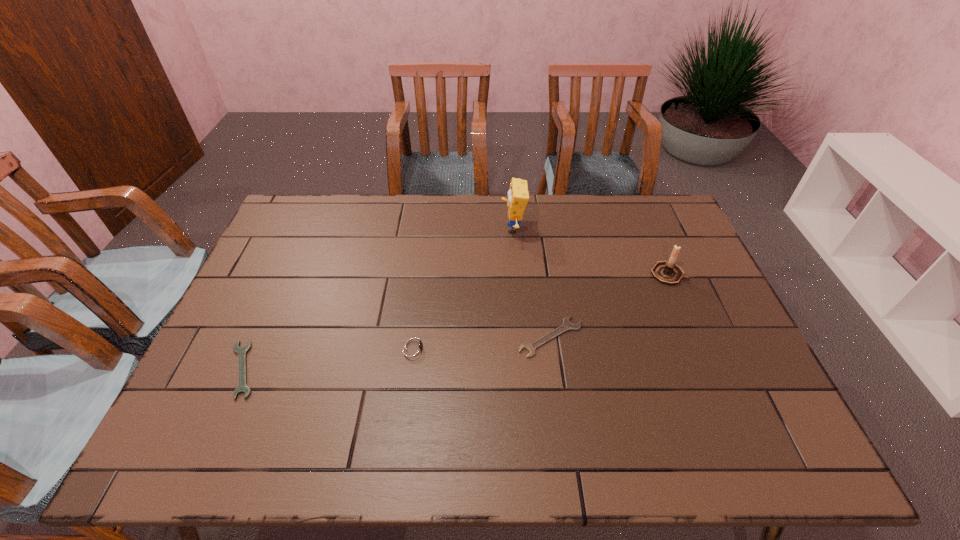
I want to click on the tallest object, so click(x=518, y=195).

At what (x,y) coordinates should I click in order to perform the action: click on sponge. Please return your answer as a coordinate pair (x, y). The image size is (960, 540). Looking at the image, I should click on (518, 195).

Find the location of a particular element. This screenshot has height=540, width=960. the rightmost object is located at coordinates (667, 272).

Identify the location of the second tallest object. This screenshot has height=540, width=960. (667, 272).

The image size is (960, 540). Identify the location of watch. (413, 348).

Where is `the second object from left to right`? This screenshot has height=540, width=960. the second object from left to right is located at coordinates (413, 348).

Where is `the right wrench`? the right wrench is located at coordinates (567, 325).

This screenshot has width=960, height=540. What are the coordinates of `the left wrench` in the screenshot? It's located at (242, 387).

Find the location of a particular element. Image resolution: width=960 pixels, height=540 pixels. free point located 0.200m on the face of the farthest object is located at coordinates (442, 228).

At what (x,y) coordinates should I click in order to perform the action: click on vacant space located on the face of the farthest object. Please return your answer as a coordinate pair (x, y). Image resolution: width=960 pixels, height=540 pixels. Looking at the image, I should click on (477, 228).